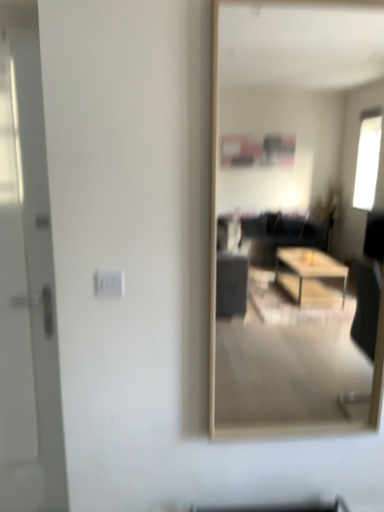
Where is `transparent glass mirror at center`? The width and height of the screenshot is (384, 512). transparent glass mirror at center is located at coordinates (289, 215).

Find the location of a particular element. white glossy door at left is located at coordinates (27, 280).

Where is `white plastic electric outlet at center`? This screenshot has width=384, height=512. white plastic electric outlet at center is located at coordinates (109, 283).

At what (x,y) coordinates should I click in order to perform the action: click on transparent glass mirror at center. Please return your answer as a coordinate pair (x, y). This screenshot has height=512, width=384. Looking at the image, I should click on (289, 215).

Between transparent glass mirror at center and white plastic electric outlet at center, which one has smaller width?

white plastic electric outlet at center.

Could you tell me if transparent glass mirror at center is turned towards white plastic electric outlet at center?

No, transparent glass mirror at center is not aimed at white plastic electric outlet at center.

From the image's perspective, is transparent glass mirror at center on white plastic electric outlet at center?

Indeed, from the image's perspective, transparent glass mirror at center is shown above white plastic electric outlet at center.

You are a GUI agent. You are given a task and a screenshot of the screen. Output one action in this format:
    pyautogui.click(x=<x>, y=<y>)
    Task: Click on the mirror that is above the white plastic electric outlet at center (from the image's perspective)
    
    Given the screenshot: What is the action you would take?
    (289, 215)

Is transparent glass mirror at center to the right of white glossy door at left from the viewer's perspective?

Indeed, transparent glass mirror at center is positioned on the right side of white glossy door at left.

How many degrees apart are the facing directions of transparent glass mirror at center and white glossy door at left?

0.00477 degrees separate the facing orientations of transparent glass mirror at center and white glossy door at left.

From the image's perspective, which is below, transparent glass mirror at center or white glossy door at left?

From the image's view, white glossy door at left is below.

This screenshot has width=384, height=512. In order to click on door directly beneath the transparent glass mirror at center (from a real-world perspective) in this screenshot , I will do `click(27, 280)`.

Does white plastic electric outlet at center have a greater width compared to transparent glass mirror at center?

In fact, white plastic electric outlet at center might be narrower than transparent glass mirror at center.

From a real-world perspective, is white plastic electric outlet at center beneath transparent glass mirror at center?

Yes, from a real-world perspective, white plastic electric outlet at center is below transparent glass mirror at center.

Which object is further away from the camera taking this photo, white plastic electric outlet at center or transparent glass mirror at center?

white plastic electric outlet at center is further from the camera.

How different are the orientations of white plastic electric outlet at center and transparent glass mirror at center in degrees?

0.194 degrees.

Based on the photo, which is more distant, (118,279) or (21,86)?

The point (21,86) is more distant.

Is white plastic electric outlet at center taller or shorter than white glossy door at left?

Considering their sizes, white plastic electric outlet at center has less height than white glossy door at left.

From the image's perspective, is white plastic electric outlet at center located above or below white glossy door at left?

Clearly, from the image's perspective, white plastic electric outlet at center is above white glossy door at left.

Is white plastic electric outlet at center positioned far away from white glossy door at left?

white plastic electric outlet at center is near white glossy door at left, not far away.

Would you consider white glossy door at left to be distant from white plastic electric outlet at center?

No, white glossy door at left is not far from white plastic electric outlet at center.

Does point (22, 18) come behind point (122, 292)?

That is False.

Is white glossy door at left at the right side of white plastic electric outlet at center?

Incorrect, white glossy door at left is not on the right side of white plastic electric outlet at center.

Between white glossy door at left and white plastic electric outlet at center, which one is positioned in front?

white glossy door at left is in front.

From the image's perspective, is white glossy door at left beneath transparent glass mirror at center?

Indeed, from the image's perspective, white glossy door at left is shown beneath transparent glass mirror at center.

Measure the distance between white glossy door at left and transparent glass mirror at center.

A distance of 1.44 meters exists between white glossy door at left and transparent glass mirror at center.

Is white glossy door at left next to transparent glass mirror at center and touching it?

No, white glossy door at left is not next to transparent glass mirror at center.

What's the angular difference between white glossy door at left and transparent glass mirror at center's facing directions?

They differ by 0.00477 degrees in their facing directions.

What are the coordinates of `electric outlet that is behind the transparent glass mirror at center` in the screenshot? It's located at (109, 283).

What are the coordinates of `mirror above the white glossy door at left (from the image's perspective)` in the screenshot? It's located at click(x=289, y=215).

Looking at this image, which object lies further to the anchor point transparent glass mirror at center, white plastic electric outlet at center or white glossy door at left?

white plastic electric outlet at center is further to transparent glass mirror at center.

Considering their positions, is transparent glass mirror at center positioned further to white glossy door at left than white plastic electric outlet at center?

Among the two, transparent glass mirror at center is located further to white glossy door at left.

Based on their spatial positions, is white glossy door at left or transparent glass mirror at center further from white plastic electric outlet at center?

transparent glass mirror at center lies further to white plastic electric outlet at center than the other object.

Which object lies further to the anchor point transparent glass mirror at center, white glossy door at left or white plastic electric outlet at center?

white plastic electric outlet at center is further to transparent glass mirror at center.

Based on their spatial positions, is white plastic electric outlet at center or transparent glass mirror at center further from white glossy door at left?

transparent glass mirror at center.

Based on their spatial positions, is transparent glass mirror at center or white glossy door at left closer to white plastic electric outlet at center?

Among the two, white glossy door at left is located nearer to white plastic electric outlet at center.

You are a GUI agent. You are given a task and a screenshot of the screen. Output one action in this format:
    pyautogui.click(x=<x>, y=<y>)
    Task: Click on the electric outlet between white glossy door at left and transparent glass mirror at center
    
    Given the screenshot: What is the action you would take?
    pyautogui.click(x=109, y=283)